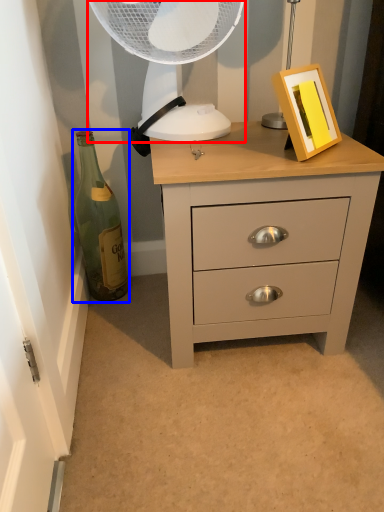
Question: Which point is further to the camera, mechanical fan (highlighted by a red box) or bottle (highlighted by a blue box)?

Choices:
 (A) mechanical fan
 (B) bottle

Answer: (B)